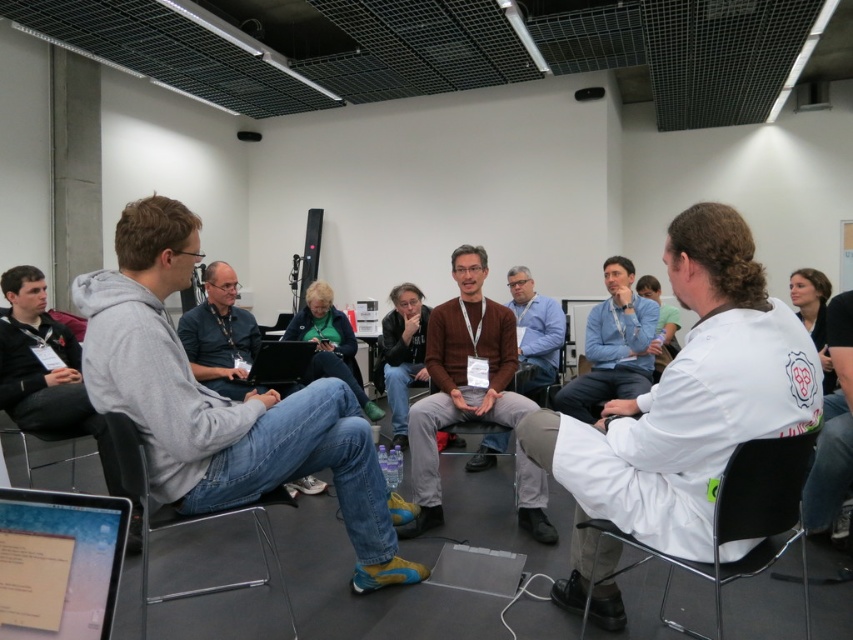
Question: Which object is positioned farthest from the metallic gray chair at lower left?

Choices:
 (A) black plastic chair at lower right
 (B) dark gray hoodie at left

Answer: (A)

Question: Among these points, which one is nearest to the camera?

Choices:
 (A) (611, 260)
 (B) (436, 513)

Answer: (B)

Question: Is gray hoodie at center thinner than metallic gray chair at lower left?

Choices:
 (A) no
 (B) yes

Answer: (B)

Question: Is silver metallic laptop at lower left thinner than clear plastic chair at lower left?

Choices:
 (A) no
 (B) yes

Answer: (B)

Question: Which point appears farthest from the camera in this image?

Choices:
 (A) (32, 481)
 (B) (769, 454)
 (C) (306, 355)
 (D) (703, 490)

Answer: (C)

Question: Is black plastic chair at lower right below blue shirt at center?

Choices:
 (A) yes
 (B) no

Answer: (A)